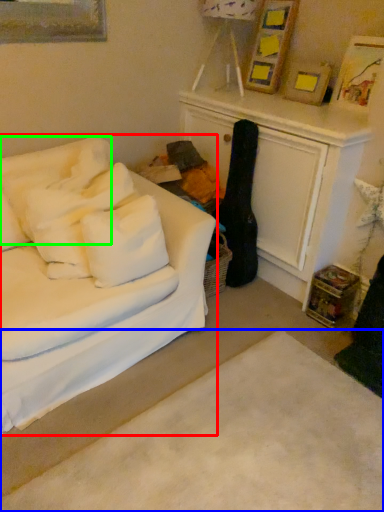
Question: Which object is the closest to the studio couch (highlighted by a red box)? Choose among these: plain (highlighted by a blue box) or pillow (highlighted by a green box).

Choices:
 (A) plain
 (B) pillow

Answer: (B)